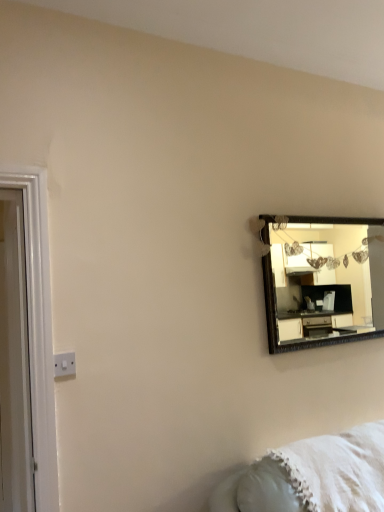
Question: Is white plastic switch at lower left not inside white fluffy blanket at lower right?

Choices:
 (A) no
 (B) yes

Answer: (B)

Question: Does white plastic switch at lower left have a lesser width compared to white fluffy blanket at lower right?

Choices:
 (A) yes
 (B) no

Answer: (A)

Question: Is the position of white plastic switch at lower left more distant than that of white fluffy blanket at lower right?

Choices:
 (A) no
 (B) yes

Answer: (B)

Question: Are white plastic switch at lower left and white fluffy blanket at lower right making contact?

Choices:
 (A) yes
 (B) no

Answer: (B)

Question: From the image's perspective, would you say white plastic switch at lower left is shown under white fluffy blanket at lower right?

Choices:
 (A) yes
 (B) no

Answer: (B)

Question: Is white plastic switch at lower left oriented away from white fluffy blanket at lower right?

Choices:
 (A) yes
 (B) no

Answer: (B)

Question: Is the surface of white glossy door at left in direct contact with white fluffy blanket at lower right?

Choices:
 (A) yes
 (B) no

Answer: (B)

Question: Does white glossy door at left have a larger size compared to white fluffy blanket at lower right?

Choices:
 (A) no
 (B) yes

Answer: (A)

Question: Are white glossy door at left and white fluffy blanket at lower right far apart?

Choices:
 (A) no
 (B) yes

Answer: (B)

Question: Is white glossy door at left oriented away from white fluffy blanket at lower right?

Choices:
 (A) yes
 (B) no

Answer: (B)

Question: Does white glossy door at left appear on the left side of white fluffy blanket at lower right?

Choices:
 (A) yes
 (B) no

Answer: (A)

Question: Is white fluffy blanket at lower right inside white glossy door at left?

Choices:
 (A) yes
 (B) no

Answer: (B)

Question: Is white plastic switch at lower left thinner than white glossy door at left?

Choices:
 (A) yes
 (B) no

Answer: (A)